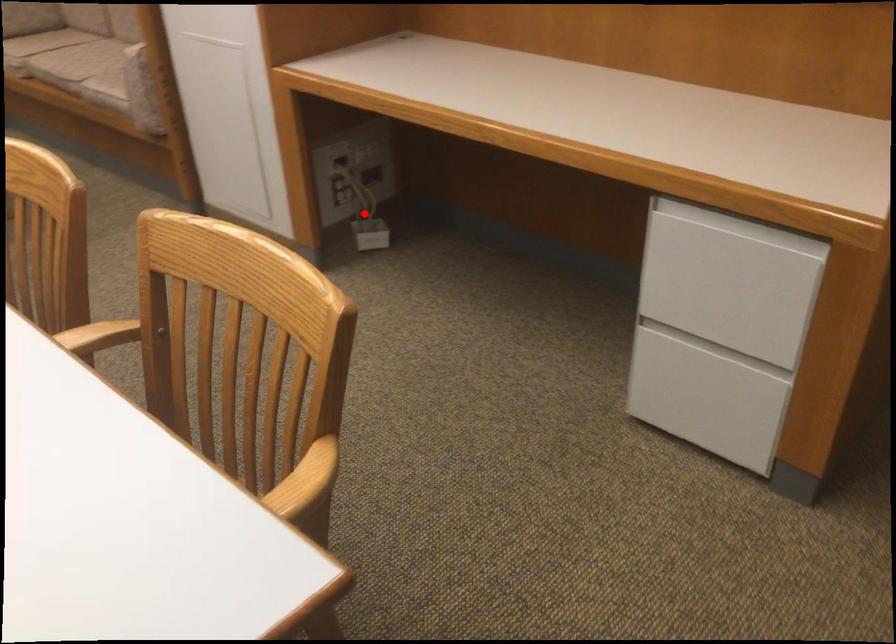
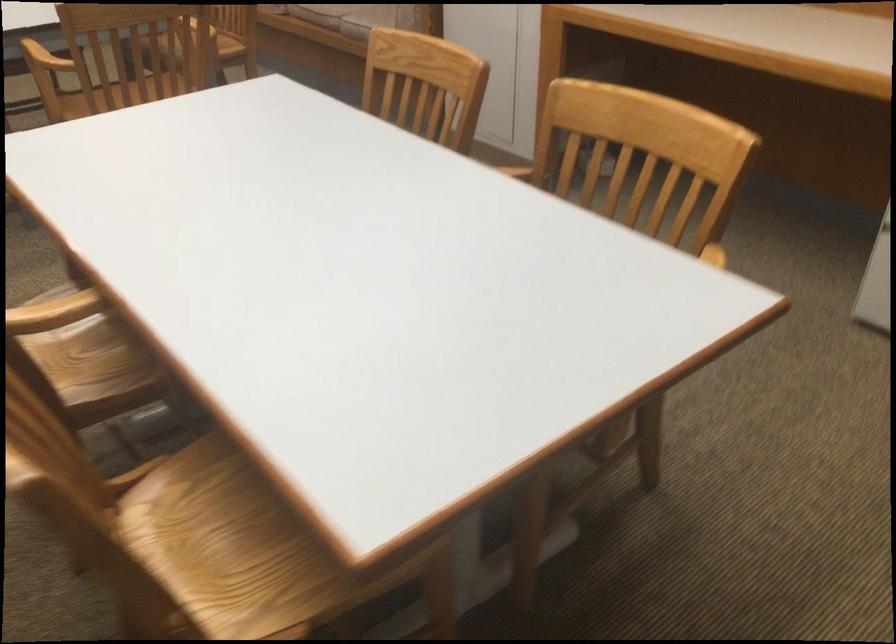
Question: I am providing you with two images of the same scene from different viewpoints. A red point is marked on the first image. Can you still see the location of the red point in image 2?

Choices:
 (A) Yes
 (B) No

Answer: (B)